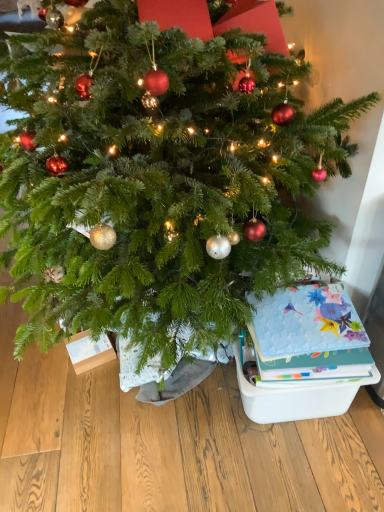
Identify the location of blank space situated above floral paper card at lower right (from a real-world perspective). (297, 307).